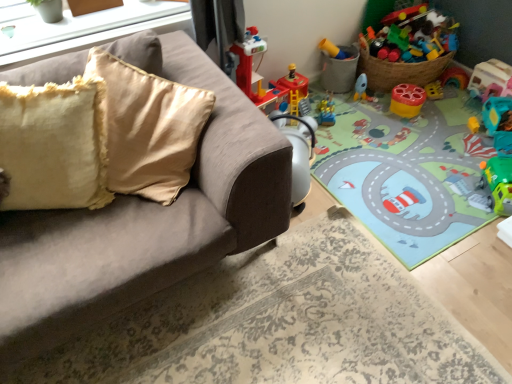
You are a GUI agent. You are given a task and a screenshot of the screen. Output one action in this format:
    pyautogui.click(x=<x>, y=<y>)
    Task: Click on the free location in front of translucent plastic toy at center, the 1th toy positioned from the left
    The height and width of the screenshot is (384, 512).
    Given the screenshot: What is the action you would take?
    pyautogui.click(x=340, y=133)